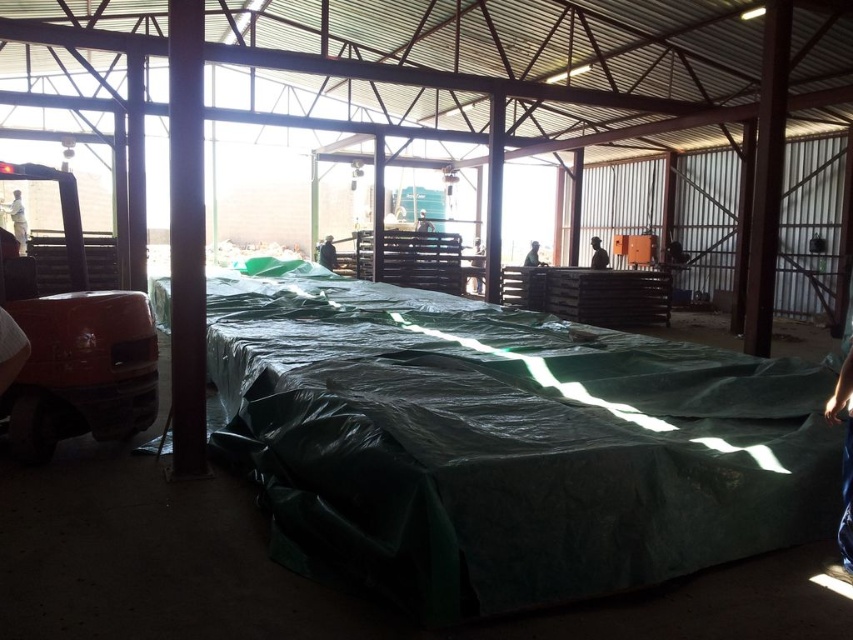
Question: Can you confirm if white matte shirt at left is positioned to the right of dark blue fabric at center?

Choices:
 (A) no
 (B) yes

Answer: (A)

Question: Among these objects, which one is farthest from the camera?

Choices:
 (A) green fabric worker at center
 (B) black fabric worker at center
 (C) white matte shirt at left

Answer: (A)

Question: Is white matte shirt at left behind green fabric worker at center?

Choices:
 (A) no
 (B) yes

Answer: (A)

Question: Considering the real-world distances, which object is farthest from the black fabric worker at center?

Choices:
 (A) green fabric worker at center
 (B) green tarp at center
 (C) white matte shirt at left

Answer: (C)

Question: Which of the following is the farthest from the observer?

Choices:
 (A) (596, 244)
 (B) (294, 369)
 (C) (16, 195)
 (D) (527, 264)

Answer: (C)

Question: Is green tarp at center in front of dark blue fabric at center?

Choices:
 (A) no
 (B) yes

Answer: (B)